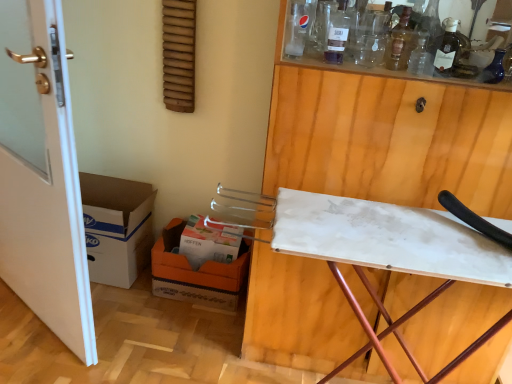
What do you see at coordinates (399, 43) in the screenshot? This screenshot has height=384, width=512. I see `translucent glass bottle at upper right, the 2th wine bottle viewed from the right` at bounding box center [399, 43].

How much space does white cardboard box at left, positioned as the 1th cardboard box in left-to-right order, occupy horizontally?

It is 31.97 centimeters.

In order to click on white marble ironing board at upper right in this screenshot , I will do `click(387, 138)`.

How much space does orange cardboard box at lower left, which is counted as the second cardboard box, starting from the left, occupy vertically?

10.41 inches.

What do you see at coordinates (42, 175) in the screenshot?
I see `white glossy door at left` at bounding box center [42, 175].

Where is `translucent glass bottle at upper right, the 2th wine bottle viewed from the right`? This screenshot has height=384, width=512. translucent glass bottle at upper right, the 2th wine bottle viewed from the right is located at coordinates (399, 43).

Who is smaller, white matte ironing board at lower right or transparent glass bottle at upper center?

transparent glass bottle at upper center is smaller.

Which of these two, white matte ironing board at lower right or transparent glass bottle at upper center, is thinner?

With smaller width is transparent glass bottle at upper center.

From a real-world perspective, is white matte ironing board at lower right located higher than transparent glass bottle at upper center?

No, from a real-world perspective, white matte ironing board at lower right is not above transparent glass bottle at upper center.

There is a white marble ironing board at upper right. At what (x,y) coordinates should I click in order to perform the action: click on bottle above it (from a real-world perspective). Please return your answer as a coordinate pair (x, y). Looking at the image, I should click on (337, 34).

Who is taller, transparent glass bottle at upper center or white marble ironing board at upper right?

white marble ironing board at upper right is taller.

Can you tell me how much transparent glass bottle at upper center and white marble ironing board at upper right differ in facing direction?

There is a 0.281-degree angle between the facing directions of transparent glass bottle at upper center and white marble ironing board at upper right.

From a real-world perspective, is transparent glass bottle at upper center physically below white marble ironing board at upper right?

No, from a real-world perspective, transparent glass bottle at upper center is not under white marble ironing board at upper right.

Is point (103, 238) closer to camera compared to point (401, 19)?

No, (103, 238) is behind (401, 19).

Is white cardboard box at left, positioned as the 1th cardboard box in left-to-right order, behind translucent glass bottle at upper right, the 2th wine bottle viewed from the right?

Yes, white cardboard box at left, positioned as the 1th cardboard box in left-to-right order, is further from the camera.

Is white cardboard box at left, the 2th cardboard box positioned from the right, taller than translucent glass bottle at upper right, the 2th wine bottle viewed from the right?

Correct, white cardboard box at left, the 2th cardboard box positioned from the right, is much taller as translucent glass bottle at upper right, the 2th wine bottle viewed from the right.

Is translucent glass bottle at upper right, placed as the 1th wine bottle when sorted from left to right, at the back of white cardboard box at left, the 2th cardboard box positioned from the right?

No, white cardboard box at left, the 2th cardboard box positioned from the right, is not facing the opposite direction of translucent glass bottle at upper right, placed as the 1th wine bottle when sorted from left to right.

Based on the photo, is white glossy door at left next to white marble ironing board at upper right?

No, white glossy door at left is not beside white marble ironing board at upper right.

Is white glossy door at left inside the boundaries of white marble ironing board at upper right, or outside?

white glossy door at left exists outside the volume of white marble ironing board at upper right.

Can you confirm if white glossy door at left is bigger than white marble ironing board at upper right?

Actually, white glossy door at left might be smaller than white marble ironing board at upper right.

Is white matte ironing board at lower right aimed at orange cardboard box at lower left, which is counted as the second cardboard box, starting from the left?

No, white matte ironing board at lower right is not facing towards orange cardboard box at lower left, which is counted as the second cardboard box, starting from the left.

Which is nearer, [419,251] or [224,296]?

Clearly, point [419,251] is closer to the camera than point [224,296].

Can you tell me how much white matte ironing board at lower right and orange cardboard box at lower left, which is counted as the second cardboard box, starting from the left, differ in facing direction?

The angular difference between white matte ironing board at lower right and orange cardboard box at lower left, which is counted as the second cardboard box, starting from the left, is 5.37 degrees.

Considering the relative sizes of white matte ironing board at lower right and orange cardboard box at lower left, which is counted as the first cardboard box, starting from the right, in the image provided, is white matte ironing board at lower right taller than orange cardboard box at lower left, which is counted as the first cardboard box, starting from the right,?

Yes, white matte ironing board at lower right is taller than orange cardboard box at lower left, which is counted as the first cardboard box, starting from the right.

Which is behind, point (189, 230) or point (442, 53)?

The point (189, 230) is more distant.

Is white cardboard box at lower center shorter than translucent glass wine bottle at upper right, which ranks as the first wine bottle in right-to-left order?

No, white cardboard box at lower center is not shorter than translucent glass wine bottle at upper right, which ranks as the first wine bottle in right-to-left order.

Looking at this image, how much distance is there between white cardboard box at lower center and translucent glass wine bottle at upper right, which ranks as the first wine bottle in right-to-left order?

white cardboard box at lower center and translucent glass wine bottle at upper right, which ranks as the first wine bottle in right-to-left order, are 3.59 feet apart from each other.

Consider the image. Is white cardboard box at lower center at the right side of translucent glass wine bottle at upper right, which ranks as the first wine bottle in right-to-left order?

Incorrect, white cardboard box at lower center is not on the right side of translucent glass wine bottle at upper right, which ranks as the first wine bottle in right-to-left order.

Which is more to the right, translucent glass wine bottle at upper right, which ranks as the first wine bottle in right-to-left order, or white cardboard box at lower center?

translucent glass wine bottle at upper right, which ranks as the first wine bottle in right-to-left order.

What's the angular difference between translucent glass wine bottle at upper right, which ranks as the first wine bottle in right-to-left order, and white cardboard box at lower center's facing directions?

3.44 degrees.

Considering the relative sizes of translucent glass wine bottle at upper right, which is the 2th wine bottle in left-to-right order, and white cardboard box at lower center in the image provided, is translucent glass wine bottle at upper right, which is the 2th wine bottle in left-to-right order, thinner than white cardboard box at lower center?

Yes.

Are translucent glass wine bottle at upper right, which ranks as the first wine bottle in right-to-left order, and white cardboard box at lower center located far from each other?

Yes.

Identify the location of bottle lying on the left of white matte ironing board at lower right. The height and width of the screenshot is (384, 512). (337, 34).

The image size is (512, 384). I want to click on cabinetry in front of the transparent glass bottle at upper center, so click(387, 138).

Estimate the real-world distances between objects in this image. Which object is further from white cardboard box at left, positioned as the 1th cardboard box in left-to-right order, white cardboard box at lower center or transparent glass bottle at upper center?

transparent glass bottle at upper center is further to white cardboard box at left, positioned as the 1th cardboard box in left-to-right order.

Looking at the image, which one is located further to orange cardboard box at lower left, which is counted as the first cardboard box, starting from the right, white cardboard box at left, positioned as the 1th cardboard box in left-to-right order, or white cardboard box at lower center?

The object further to orange cardboard box at lower left, which is counted as the first cardboard box, starting from the right, is white cardboard box at left, positioned as the 1th cardboard box in left-to-right order.

Which object lies nearer to the anchor point transparent glass bottle at upper center, white cardboard box at lower center or orange cardboard box at lower left, which is counted as the first cardboard box, starting from the right?

white cardboard box at lower center.

From the image, which object appears to be nearer to transparent glass bottle at upper center, translucent glass bottle at upper right, placed as the 1th wine bottle when sorted from left to right, or white glossy door at left?

translucent glass bottle at upper right, placed as the 1th wine bottle when sorted from left to right, lies closer to transparent glass bottle at upper center than the other object.

Estimate the real-world distances between objects in this image. Which object is closer to white cardboard box at lower center, white cardboard box at left, the 2th cardboard box positioned from the right, or translucent glass bottle at upper right, the 2th wine bottle viewed from the right?

white cardboard box at left, the 2th cardboard box positioned from the right, is positioned closer to the anchor white cardboard box at lower center.

Considering their positions, is white cardboard box at lower center positioned closer to translucent glass bottle at upper right, placed as the 1th wine bottle when sorted from left to right, than translucent glass wine bottle at upper right, which is the 2th wine bottle in left-to-right order?

translucent glass wine bottle at upper right, which is the 2th wine bottle in left-to-right order, is closer to translucent glass bottle at upper right, placed as the 1th wine bottle when sorted from left to right.

Based on the photo, based on their spatial positions, is white glossy door at left or translucent glass wine bottle at upper right, which ranks as the first wine bottle in right-to-left order, closer to white cardboard box at left, the 2th cardboard box positioned from the right?

white glossy door at left.

Considering their positions, is white marble ironing board at upper right positioned closer to white cardboard box at lower center than translucent glass wine bottle at upper right, which is the 2th wine bottle in left-to-right order?

white marble ironing board at upper right.

At what (x,y) coordinates should I click in order to perform the action: click on cardboard box located between white cardboard box at left, positioned as the 1th cardboard box in left-to-right order, and translucent glass wine bottle at upper right, which is the 2th wine bottle in left-to-right order, in the left-right direction. Please return your answer as a coordinate pair (x, y). This screenshot has height=384, width=512. Looking at the image, I should click on (196, 273).

You are a GUI agent. You are given a task and a screenshot of the screen. Output one action in this format:
    pyautogui.click(x=<x>, y=<y>)
    Task: Click on the bottle between white cardboard box at left, positioned as the 1th cardboard box in left-to-right order, and white marble ironing board at upper right, in the horizontal direction
    Image resolution: width=512 pixels, height=384 pixels.
    Given the screenshot: What is the action you would take?
    pyautogui.click(x=337, y=34)

The image size is (512, 384). What are the coordinates of `table between white glossy door at left and white marble ironing board at upper right from left to right` in the screenshot? It's located at (390, 253).

You are a GUI agent. You are given a task and a screenshot of the screen. Output one action in this format:
    pyautogui.click(x=<x>, y=<y>)
    Task: Click on the cardboard box positioned between white glossy door at left and white cardboard box at lower center from near to far
    Image resolution: width=512 pixels, height=384 pixels.
    Given the screenshot: What is the action you would take?
    pyautogui.click(x=116, y=227)